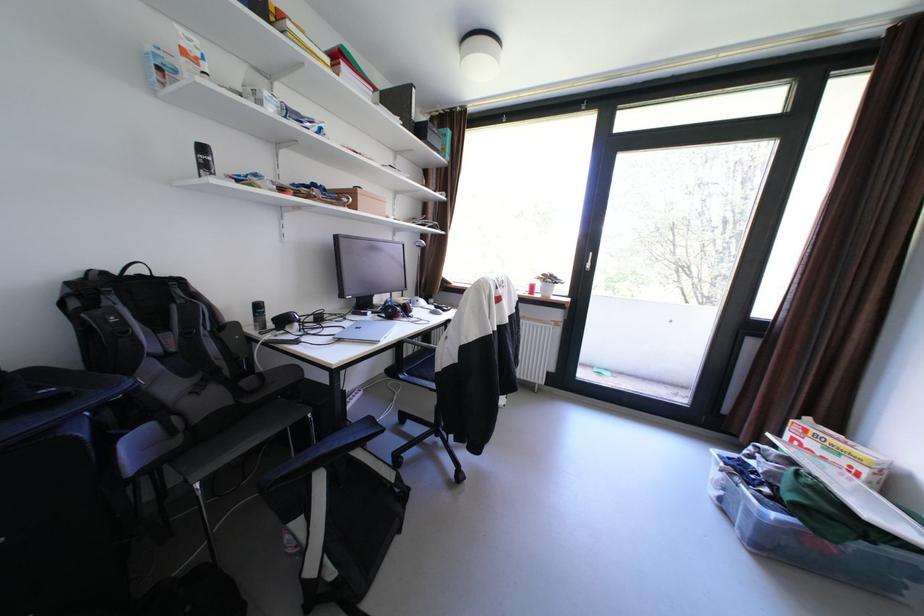
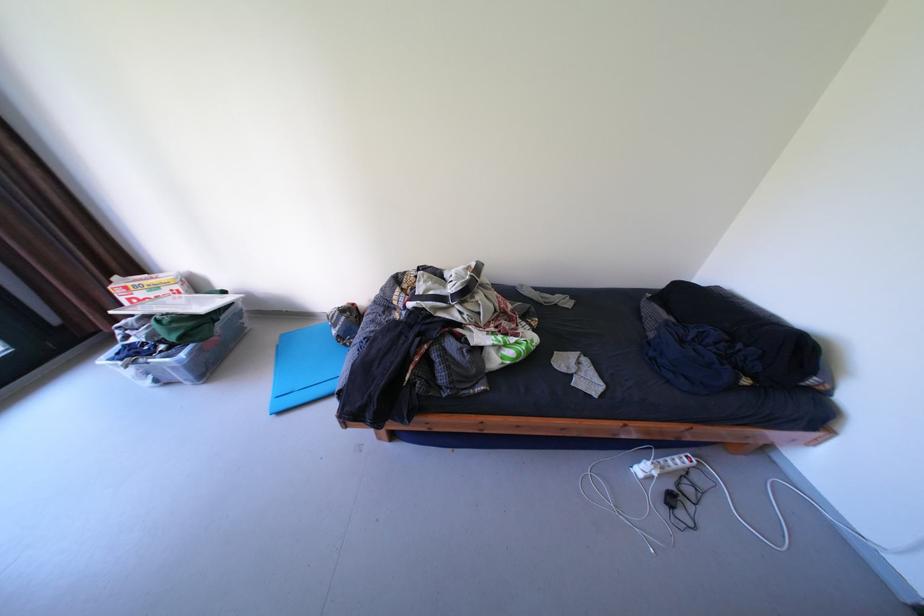
Consider the image. The first image is from the beginning of the video and the second image is from the end. How did the camera likely rotate when shooting the video?

The camera's rotation is toward right-down.